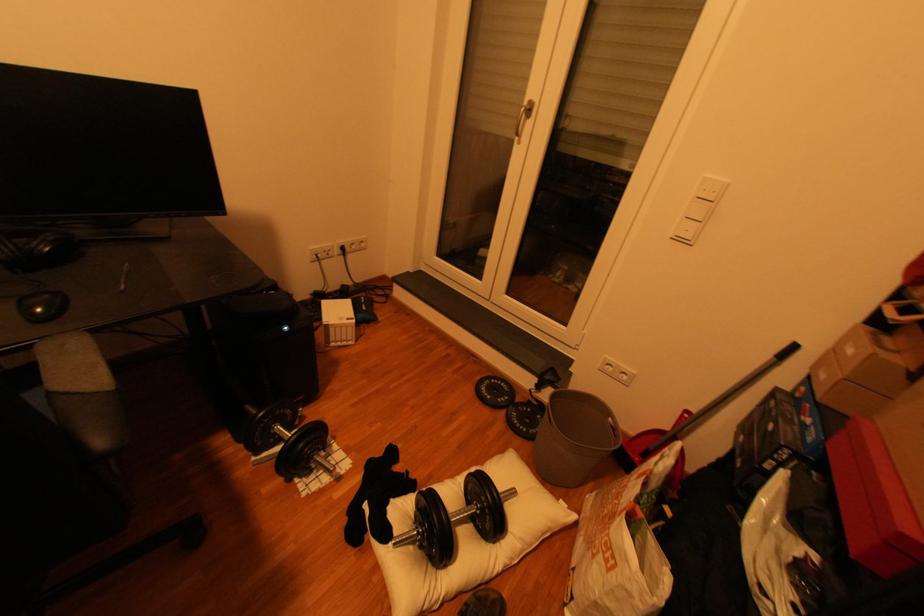
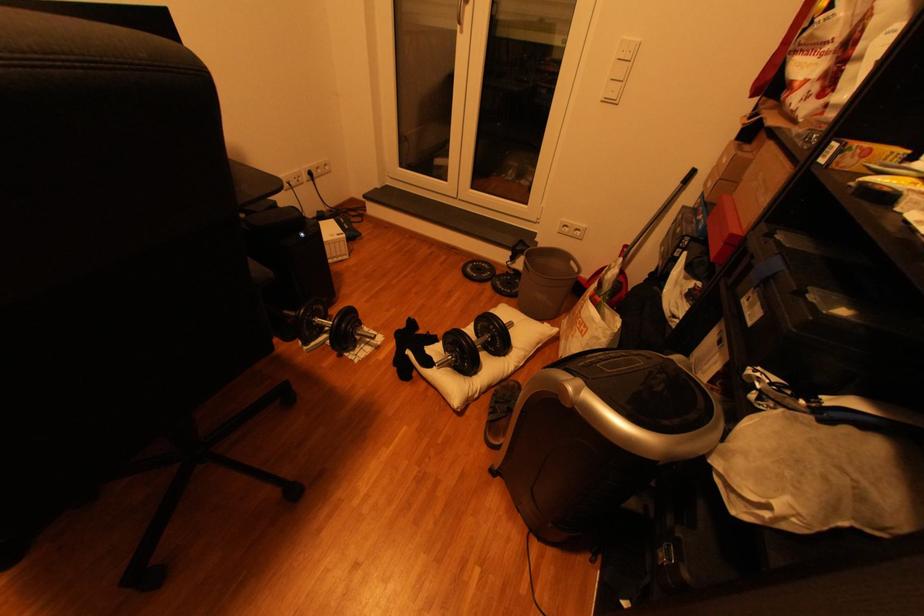
Where in the second image is the point corresponding to (310,447) from the first image?

(354, 326)